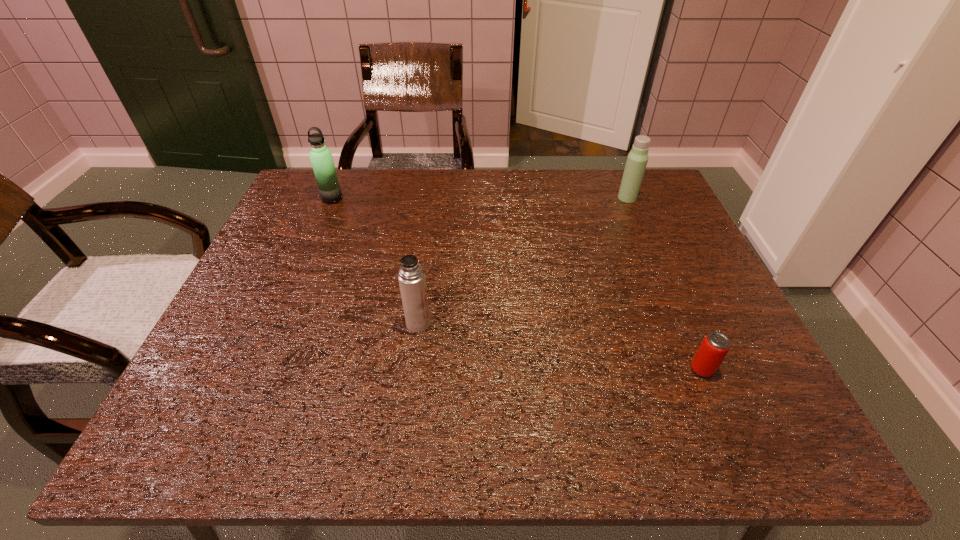
You are a GUI agent. You are given a task and a screenshot of the screen. Output one action in this format:
    pyautogui.click(x=<x>, y=<y>)
    Task: Click on the free space on the desktop that is between the octopus and the second tallest object and is positioned on the face of the farthest object
    
    Given the screenshot: What is the action you would take?
    pyautogui.click(x=478, y=310)

At what (x,y) coordinates should I click in order to perform the action: click on free spot on the desktop that is between the octopus and the bottle and is positioned on the label of the tallest object. Please return your answer as a coordinate pair (x, y). Looking at the image, I should click on (466, 310).